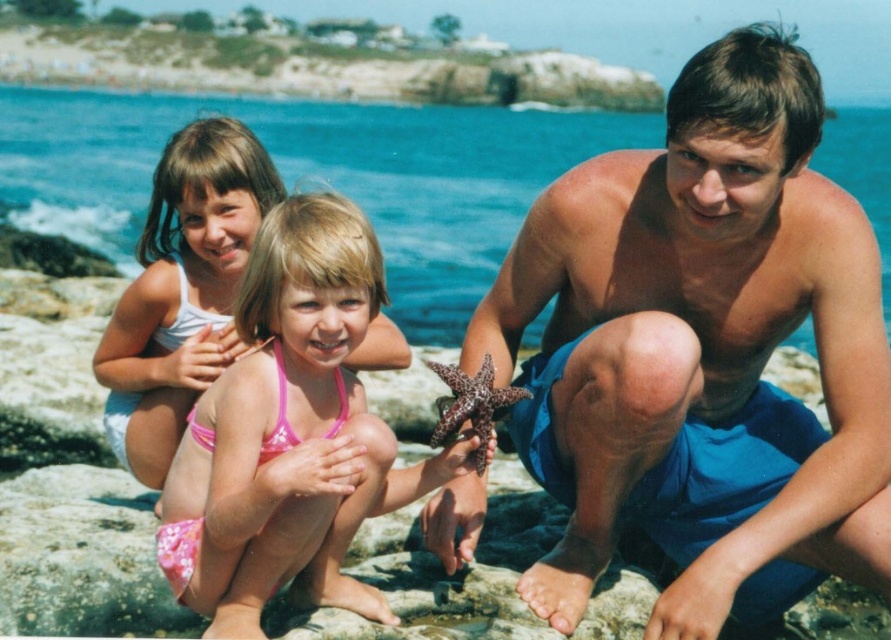
Is point (603, 131) positioned behind point (369, 589)?

Yes, it is.

Which is more to the right, blue water at upper center or pink fabric bikini at center?

Positioned to the right is pink fabric bikini at center.

Is point (876, 113) positioned behind point (360, 401)?

Yes, it is.

The image size is (891, 640). I want to click on blue water at upper center, so click(316, 177).

Which is in front, point (159, 451) or point (435, 364)?

Point (435, 364) is more forward.

Can you confirm if pink fabric bikini at upper left is positioned to the left of brown spotted starfish at center?

Yes, pink fabric bikini at upper left is to the left of brown spotted starfish at center.

Between point (249, 244) and point (464, 380), which one is positioned behind?

Point (249, 244)

The height and width of the screenshot is (640, 891). I want to click on pink fabric bikini at upper left, so click(182, 289).

Is blue fabric shorts at center positioned before pink fabric bikini at upper left?

Yes, it is in front of pink fabric bikini at upper left.

This screenshot has height=640, width=891. Identify the location of blue fabric shorts at center. (701, 353).

At what (x,y) coordinates should I click in order to perform the action: click on blue fabric shorts at center. Please return your answer as a coordinate pair (x, y). The width and height of the screenshot is (891, 640). Looking at the image, I should click on (701, 353).